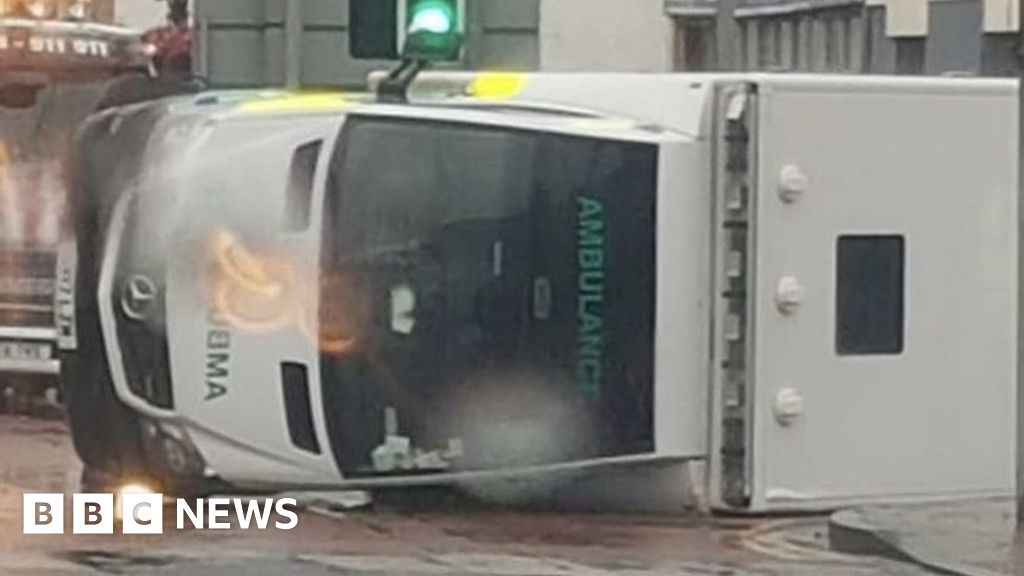
This screenshot has height=576, width=1024. I want to click on wall, so click(603, 35).